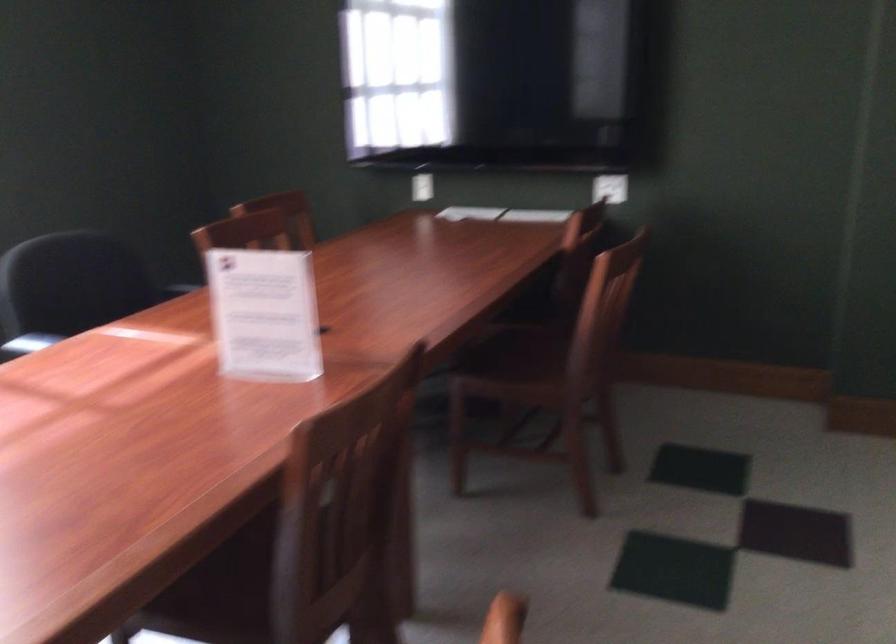
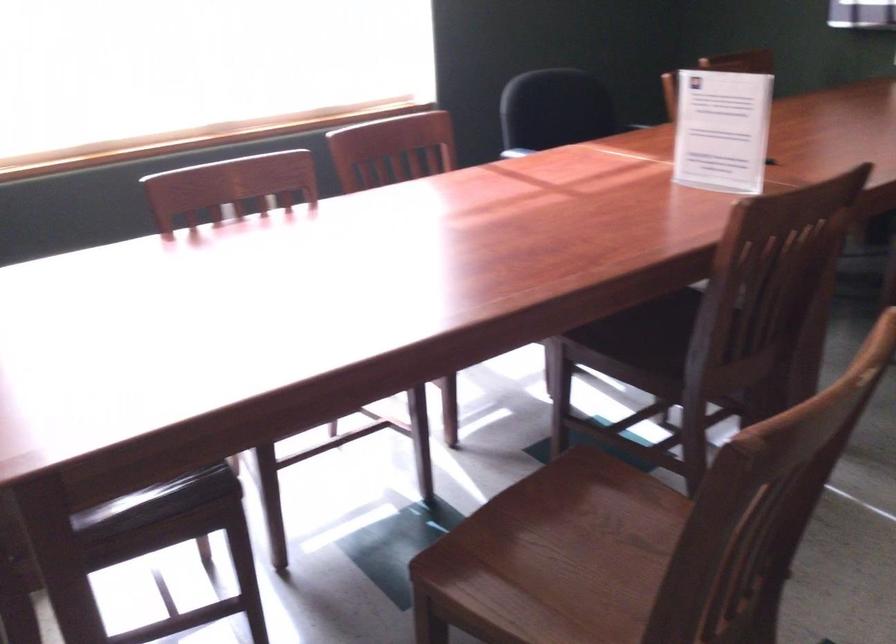
Question: How did the camera likely rotate?

Choices:
 (A) Left
 (B) Right
 (C) Up
 (D) Down

Answer: (A)